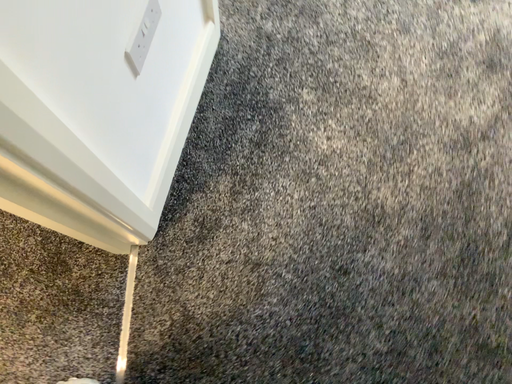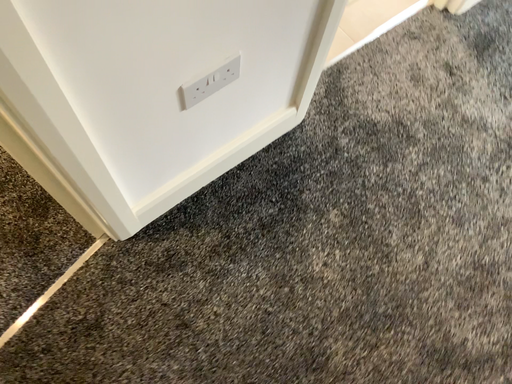
Question: Which way did the camera rotate in the video?

Choices:
 (A) rotated upward
 (B) rotated downward

Answer: (A)